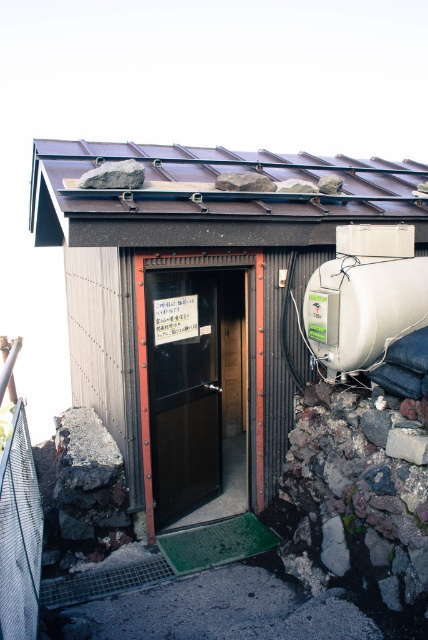
You are a painter who needs to decide whether to bring a 10 feet ladder or a 12 feet ladder to paint the brown corrugated metal roof at upper center. The matte black door at center is 8 feet wide. Can you determine which ladder length is appropriate based on the width comparison between the two objects?

The brown corrugated metal roof at upper center might be wider than matte black door at center. Since the door is 8 feet wide, if the roof is wider, a 12 feet ladder would be more appropriate to ensure sufficient reach. If they are similar in width, a 10 feet ladder could suffice, but given the uncertainty, the safer choice is the 12 feet ladder.

You are a maintenance worker needing to reach both the brown corrugated metal roof at upper center and the white matte water tank at upper right. Given that your ladder can extend up to 4 feet, can you safely access both objects with the ladder without moving it?

The distance between the brown corrugated metal roof at upper center and the white matte water tank at upper right is 4.15 feet. Since the ladder can only extend up to 4 feet, it is not long enough to safely reach both objects without moving it.